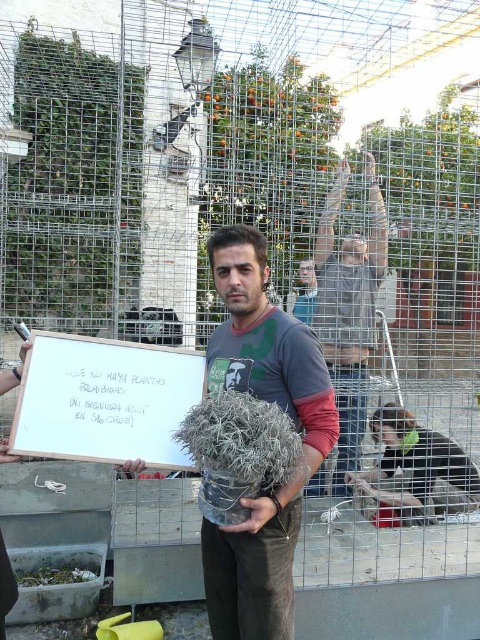
Question: Does gray cotton shirt at center lie in front of dark gray fabric shirt at lower right?

Choices:
 (A) yes
 (B) no

Answer: (B)

Question: Which of these objects is positioned closest to the white paper sign at center?

Choices:
 (A) dark gray fabric shirt at lower right
 (B) blue fabric shirt at center
 (C) green fuzzy plant at center

Answer: (C)

Question: Which of the following is the closest to the observer?

Choices:
 (A) gray cotton shirt at center
 (B) dark gray fabric shirt at lower right

Answer: (B)

Question: Which point is closer to the camera taking this photo?

Choices:
 (A) (385, 440)
 (B) (74, 356)

Answer: (B)

Question: Can you confirm if gray cotton shirt at center is bigger than blue fabric shirt at center?

Choices:
 (A) yes
 (B) no

Answer: (A)

Question: Is green leafy plant at center closer to camera compared to gray cotton shirt at center?

Choices:
 (A) yes
 (B) no

Answer: (B)